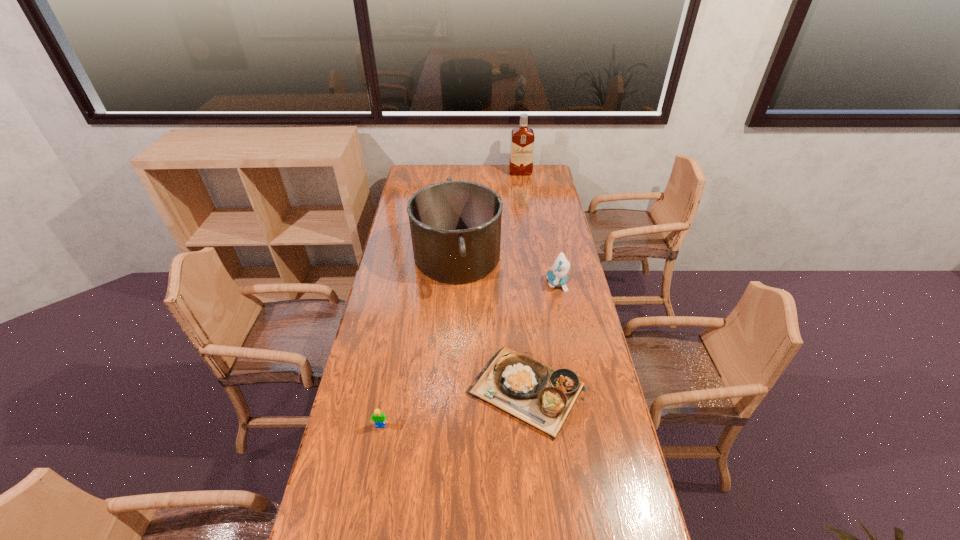
Image resolution: width=960 pixels, height=540 pixels. What are the coordinates of `free space located on the face of the kitten` in the screenshot? It's located at tap(458, 284).

You are a GUI agent. You are given a task and a screenshot of the screen. Output one action in this format:
    pyautogui.click(x=<x>, y=<y>)
    Task: Click on the free spot located on the face of the Lego
    Image resolution: width=960 pixels, height=540 pixels.
    Given the screenshot: What is the action you would take?
    tap(370, 483)

Locate an element on the screen. This screenshot has width=960, height=540. free space located on the left of the shortest object is located at coordinates (392, 392).

Find the location of a particular element. This screenshot has height=540, width=960. object that is positioned at the far edge is located at coordinates (522, 138).

Locate an element on the screen. pan at the left edge is located at coordinates (455, 226).

Locate an element on the screen. The image size is (960, 540). Lego at the left edge is located at coordinates (379, 418).

Find the location of `liquor that is positioned at the right edge`. liquor that is positioned at the right edge is located at coordinates (522, 138).

I want to click on kitten at the right edge, so click(557, 277).

Image resolution: width=960 pixels, height=540 pixels. I want to click on platter that is at the right edge, so click(x=542, y=397).

Identify the location of object present at the far right corner. (522, 138).